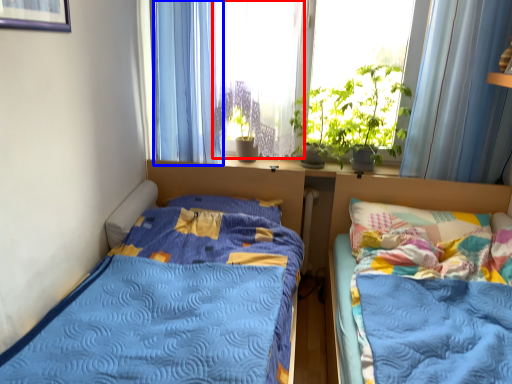
Question: Among these objects, which one is nearest to the camera, window screen (highlighted by a red box) or curtain (highlighted by a blue box)?

Choices:
 (A) window screen
 (B) curtain

Answer: (A)